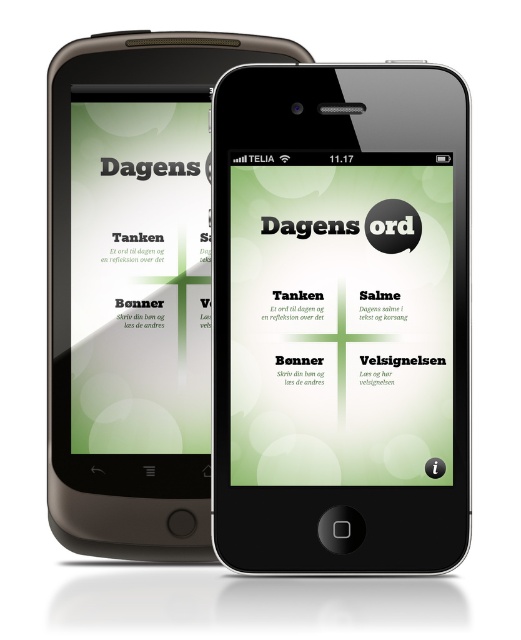
Can you confirm if matte black smartphone at left is positioned above matte green paper at left?

Incorrect, matte black smartphone at left is not positioned above matte green paper at left.

Find the location of a particular element. This screenshot has width=521, height=640. matte black smartphone at left is located at coordinates (133, 289).

Between matte black smartphone at center and matte black smartphone at left, which one appears on the right side from the viewer's perspective?

From the viewer's perspective, matte black smartphone at center appears more on the right side.

The width and height of the screenshot is (521, 640). I want to click on matte black smartphone at center, so click(x=341, y=317).

What do you see at coordinates (341, 317) in the screenshot? I see `matte black smartphone at center` at bounding box center [341, 317].

The image size is (521, 640). Find the location of `matte black smartphone at center`. matte black smartphone at center is located at coordinates (341, 317).

Is matte black smartphone at center closer to the viewer compared to matte green paper at left?

Yes, matte black smartphone at center is in front of matte green paper at left.

The height and width of the screenshot is (640, 521). What do you see at coordinates (341, 317) in the screenshot? I see `matte black smartphone at center` at bounding box center [341, 317].

Is point (289, 408) in front of point (150, 212)?

That is True.

Find the location of a particular element. This screenshot has height=640, width=521. matte black smartphone at center is located at coordinates (341, 317).